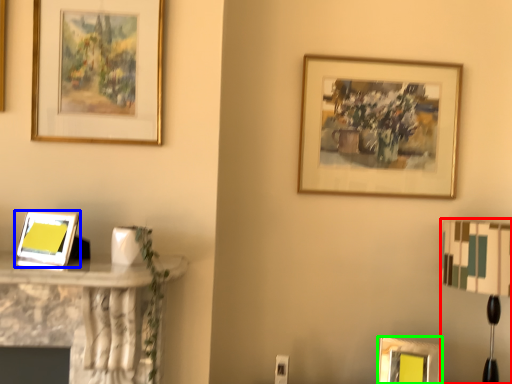
Question: Based on their relative distances, which object is nearer to table lamp (highlighted by a red box)? Choose from picture frame (highlighted by a blue box) and picture frame (highlighted by a green box).

Choices:
 (A) picture frame
 (B) picture frame

Answer: (B)